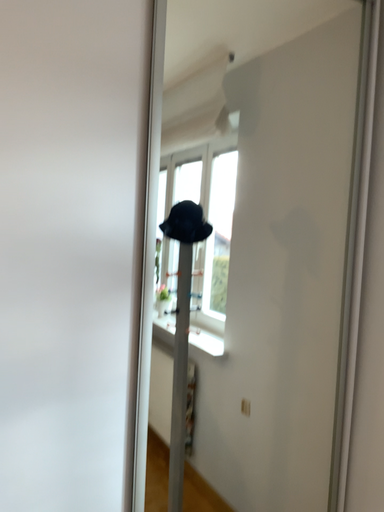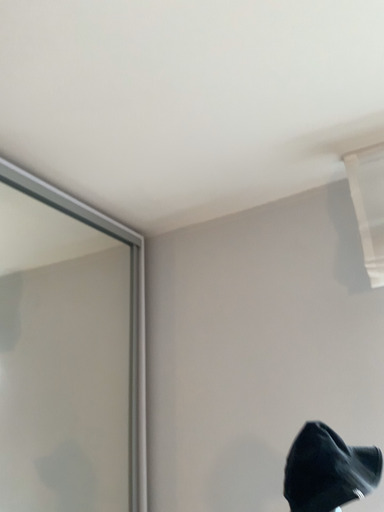
Question: Which way did the camera rotate in the video?

Choices:
 (A) rotated left
 (B) rotated right

Answer: (B)